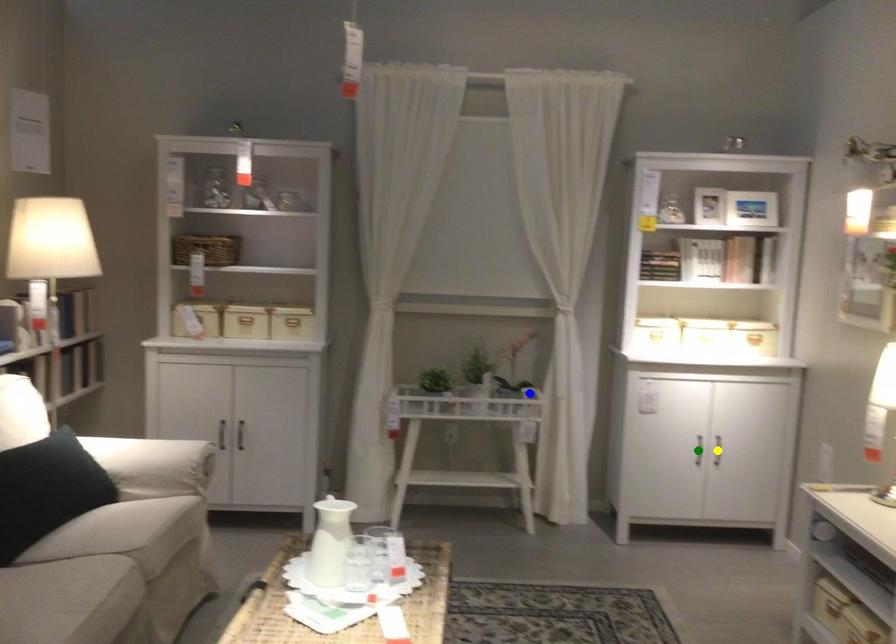
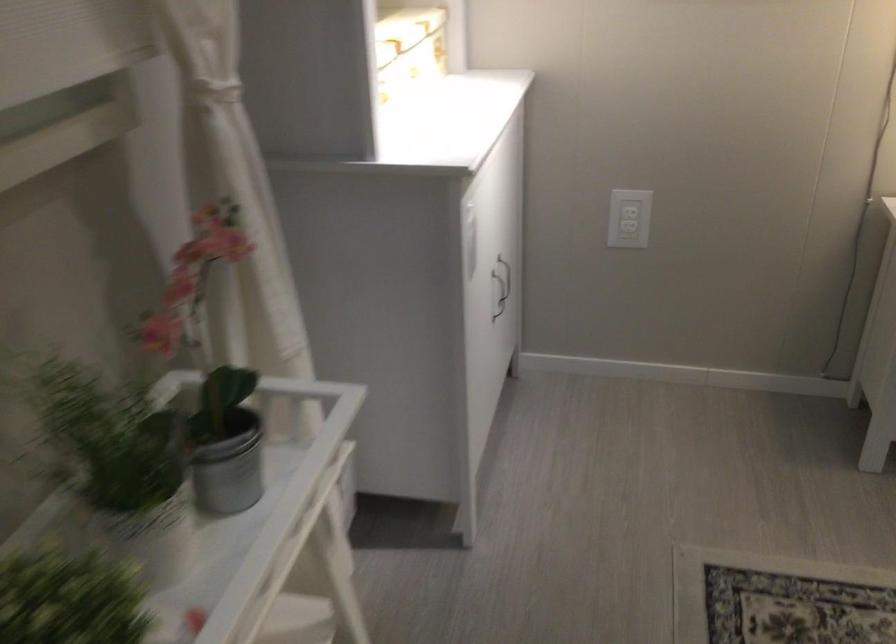
I am providing you with two images of the same scene from different viewpoints. Three points are marked in image1. Which point corresponds to a part or object that is occluded in image2?In image1, three points are marked. Which of them correspond to a part or object that is occluded in image2?Among the three points shown in image1, which one corresponds to a part or object that is no longer visible due to occlusion in image2?

Invisible in image2: green point, yellow point.